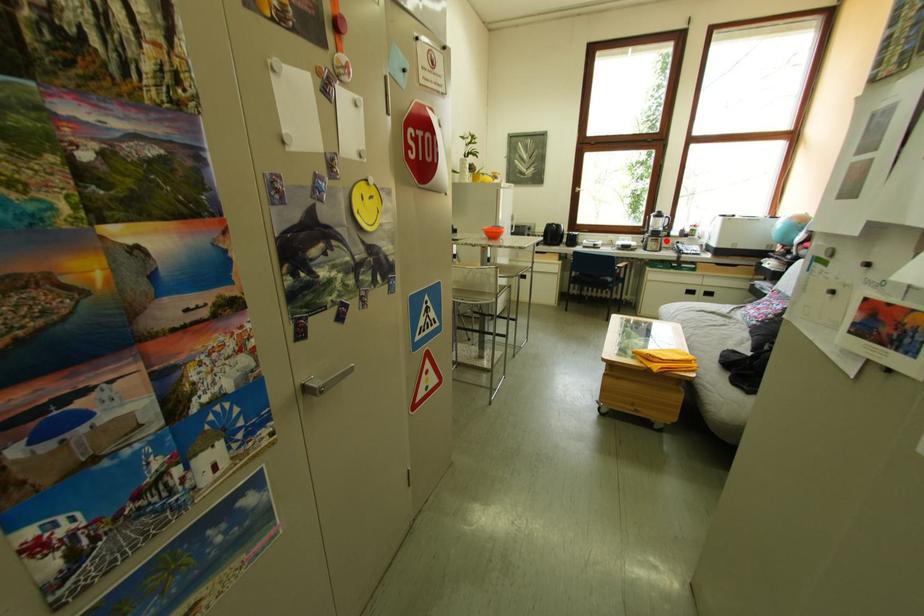
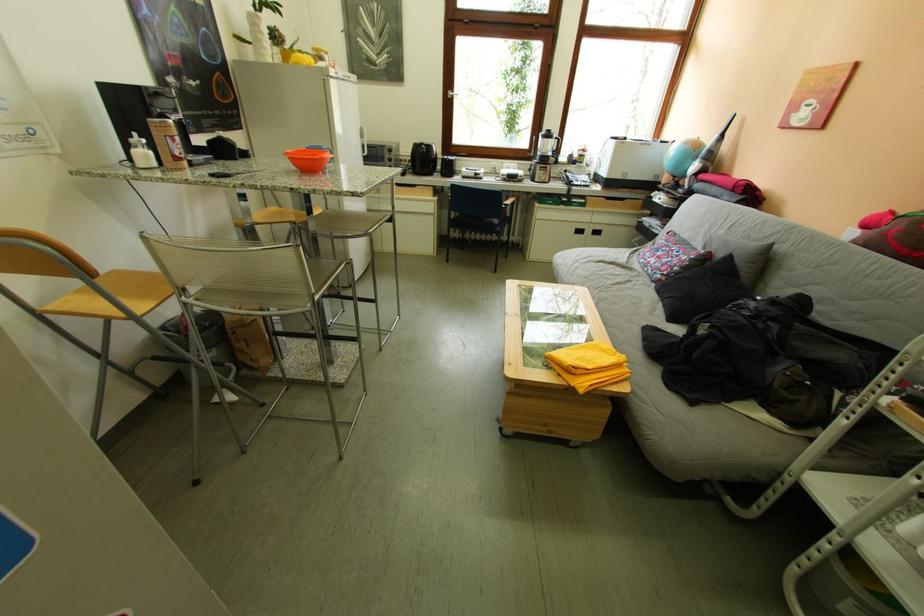
Question: I am providing you with two images of the same scene from different viewpoints. Given a red point in image1, look at the same physical point in image2. Is it:

Choices:
 (A) Closer to the viewpoint
 (B) Farther from the viewpoint

Answer: (A)